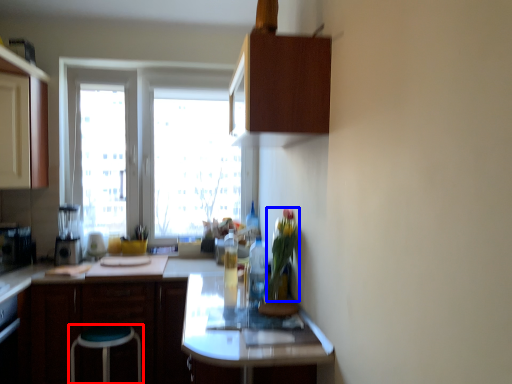
Question: Which object is closer to the camera taking this photo, stool (highlighted by a red box) or plant (highlighted by a blue box)?

Choices:
 (A) stool
 (B) plant

Answer: (B)